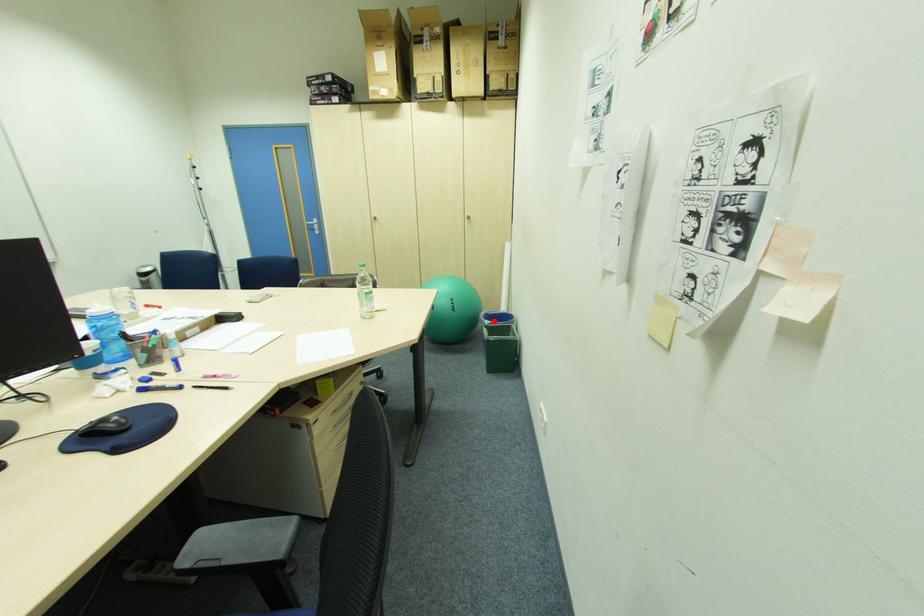
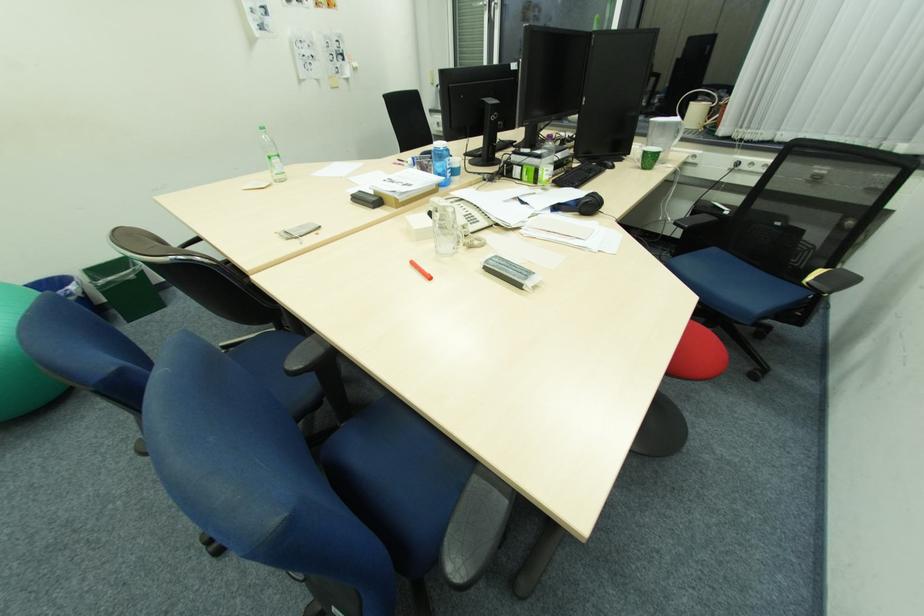
Question: I am providing you with two images of the same scene from different viewpoints. Image1 has a red point marked. In image2, the corresponding 3D location appears at what relative position? Reply with the corresponding letter.

Choices:
 (A) Closer
 (B) Farther

Answer: (B)